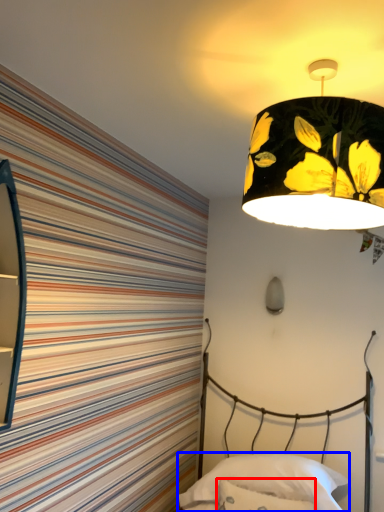
Question: Which object appears farthest to the camera in this image, throw pillow (highlighted by a red box) or pillow (highlighted by a blue box)?

Choices:
 (A) throw pillow
 (B) pillow

Answer: (B)